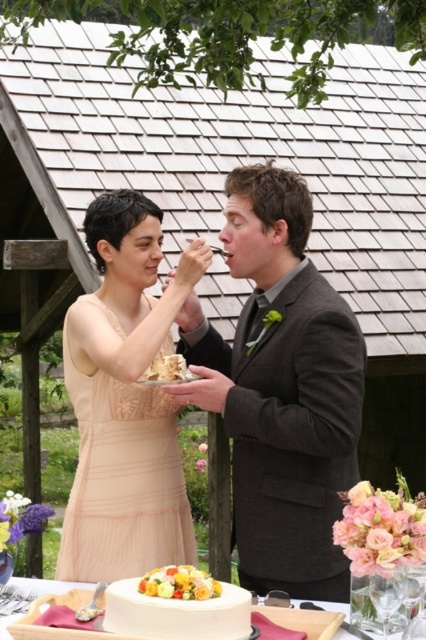
Question: Is dark gray suit at center smaller than white creamy cake at upper center?

Choices:
 (A) no
 (B) yes

Answer: (A)

Question: Which of the following is the closest to the observer?

Choices:
 (A) (163, 365)
 (B) (229, 365)
 (C) (416, 588)
 (D) (155, 570)

Answer: (C)

Question: Which point is closer to the camera?

Choices:
 (A) (158, 636)
 (B) (259, 228)
 (C) (161, 588)

Answer: (A)

Question: Which point is closer to the camera?

Choices:
 (A) (169, 372)
 (B) (282, 600)
 (C) (195, 634)
 (D) (186, 589)

Answer: (C)

Question: Can you confirm if white fondant cake at center is wider than white creamy cake at upper center?

Choices:
 (A) yes
 (B) no

Answer: (A)

Question: Does white fondant cake at center come in front of white creamy cake at upper center?

Choices:
 (A) yes
 (B) no

Answer: (A)